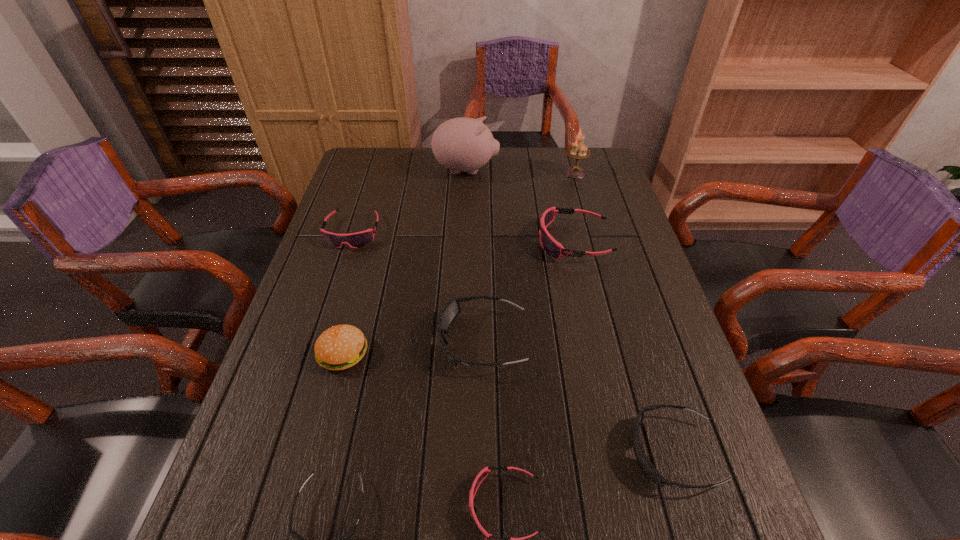
The height and width of the screenshot is (540, 960). I want to click on blank area located 0.330m on the lenses of the second biggest black goggles, so click(458, 453).

Locate an element on the screen. piggy bank that is at the far edge is located at coordinates (462, 144).

The height and width of the screenshot is (540, 960). In order to click on candle holder that is positioned at the far edge in this screenshot , I will do `click(577, 151)`.

The height and width of the screenshot is (540, 960). Identify the location of patty at the left edge. (340, 347).

Identify the location of goggles located in the left edge section of the desktop. (355, 240).

This screenshot has height=540, width=960. Identify the location of candle holder located in the right edge section of the desktop. coord(577,151).

At what (x,y) coordinates should I click in order to perform the action: click on object at the far right corner. Please return your answer as a coordinate pair (x, y). Looking at the image, I should click on (577, 151).

The image size is (960, 540). In the image, there is a desktop. What are the coordinates of `vacant space at the far edge` in the screenshot? It's located at (530, 169).

At what (x,y) coordinates should I click in order to perform the action: click on vacant space at the left edge of the desktop. Please return your answer as a coordinate pair (x, y). This screenshot has height=540, width=960. Looking at the image, I should click on (364, 259).

In order to click on free space at the right edge of the desktop in this screenshot , I will do click(615, 191).